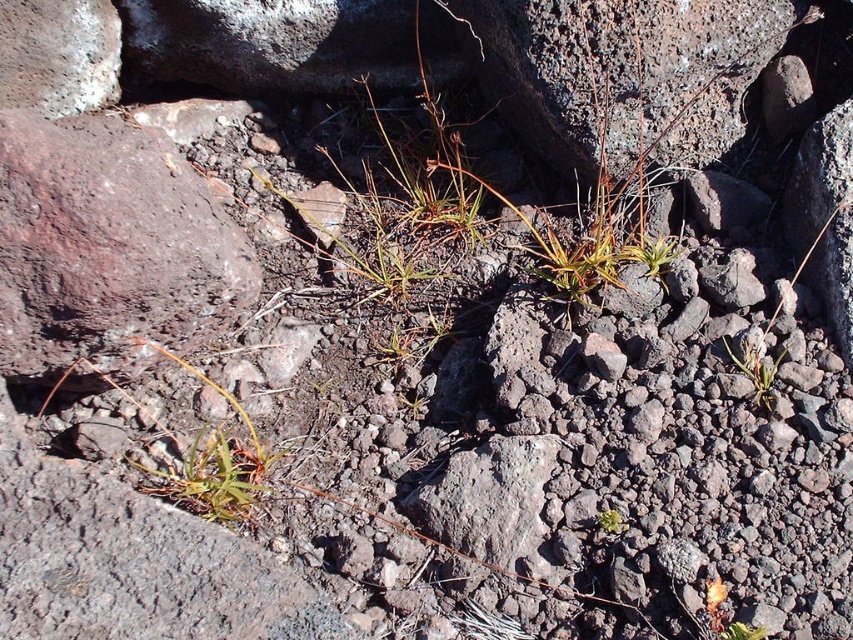
Question: Is green grass at center to the right of green leafy plant at center from the viewer's perspective?

Choices:
 (A) no
 (B) yes

Answer: (B)

Question: Can you confirm if green grass at center is positioned to the left of green leafy plant at center?

Choices:
 (A) yes
 (B) no

Answer: (B)

Question: Among these points, which one is nearest to the camera?

Choices:
 (A) (596, 518)
 (B) (743, 369)

Answer: (A)

Question: Can you confirm if green grass at center is positioned below green leafy plant at center?

Choices:
 (A) no
 (B) yes

Answer: (A)